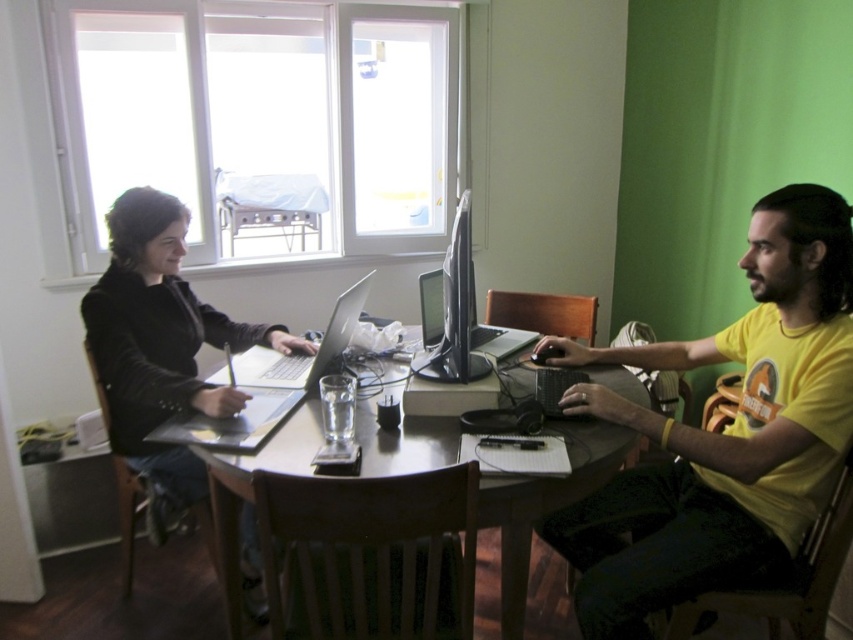
You are organizing a presentation and need to place both the matte black laptop at left and the silver metallic laptop at center on a desk. Which laptop should you place first to ensure they fit side by side without overlapping?

The matte black laptop at left is wider than the silver metallic laptop at center. Therefore, you should place the wider matte black laptop at left first to ensure there is enough space for both when placing them side by side.